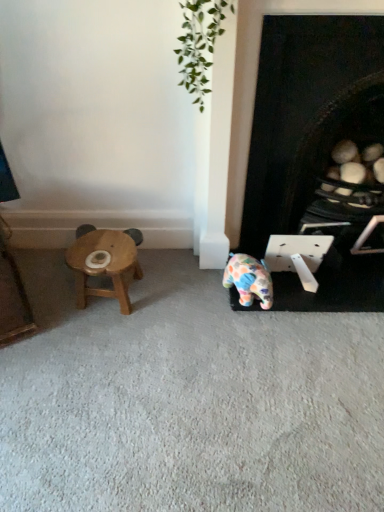
The width and height of the screenshot is (384, 512). What do you see at coordinates (307, 113) in the screenshot?
I see `black matte fireplace at lower right` at bounding box center [307, 113].

Describe the element at coordinates (249, 280) in the screenshot. I see `polka dot ceramic elephant at center` at that location.

This screenshot has width=384, height=512. Identify the location of wooden stool at left. (103, 264).

You are a GUI agent. You are given a task and a screenshot of the screen. Output one action in this format:
    pyautogui.click(x=<x>, y=<y>)
    Task: Click on the black matte fireplace at lower right
    The image size is (384, 512).
    Given the screenshot: What is the action you would take?
    pyautogui.click(x=307, y=113)

Considering the relative positions of wooden stool at left and polka dot ceramic elephant at center in the image provided, is wooden stool at left to the left of polka dot ceramic elephant at center from the viewer's perspective?

Indeed, wooden stool at left is positioned on the left side of polka dot ceramic elephant at center.

Looking at this image, from the image's perspective, would you say wooden stool at left is shown under polka dot ceramic elephant at center?

Incorrect, from the image's perspective, wooden stool at left is higher than polka dot ceramic elephant at center.

Measure the distance between wooden stool at left and polka dot ceramic elephant at center.

They are 19.07 inches apart.

Is wooden stool at left looking in the opposite direction of black matte fireplace at lower right?

wooden stool at left is not turned away from black matte fireplace at lower right.

Considering the sizes of wooden stool at left and black matte fireplace at lower right in the image, is wooden stool at left taller or shorter than black matte fireplace at lower right?

wooden stool at left is shorter than black matte fireplace at lower right.

Is point (79, 302) more distant than point (283, 286)?

No, it is in front of (283, 286).

Is wooden stool at left directly adjacent to black matte fireplace at lower right?

No, wooden stool at left is not making contact with black matte fireplace at lower right.

Is black matte fireplace at lower right completely or partially outside of polka dot ceramic elephant at center?

black matte fireplace at lower right is positioned outside polka dot ceramic elephant at center.

Is black matte fireplace at lower right in front of or behind polka dot ceramic elephant at center in the image?

In the image, black matte fireplace at lower right appears in front of polka dot ceramic elephant at center.

From a real-world perspective, does black matte fireplace at lower right stand above polka dot ceramic elephant at center?

Yes, from a real-world perspective, black matte fireplace at lower right is over polka dot ceramic elephant at center

How different are the orientations of black matte fireplace at lower right and polka dot ceramic elephant at center in degrees?

There is a 5.28-degree angle between the facing directions of black matte fireplace at lower right and polka dot ceramic elephant at center.

Measure the distance from polka dot ceramic elephant at center to wooden stool at left.

polka dot ceramic elephant at center is 19.07 inches from wooden stool at left.

Looking at this image, is polka dot ceramic elephant at center positioned far away from wooden stool at left?

They are positioned close to each other.

From the image's perspective, which object appears higher, polka dot ceramic elephant at center or wooden stool at left?

wooden stool at left.

Is polka dot ceramic elephant at center looking in the opposite direction of wooden stool at left?

No, polka dot ceramic elephant at center is not facing away from wooden stool at left.

Which is correct: black matte fireplace at lower right is inside wooden stool at left, or outside of it?

black matte fireplace at lower right lies outside wooden stool at left.

Between black matte fireplace at lower right and wooden stool at left, which one has smaller size?

wooden stool at left is smaller.

From the image's perspective, is black matte fireplace at lower right positioned above or below wooden stool at left?

Based on their image positions, black matte fireplace at lower right is located above wooden stool at left.

Consider the image. Which object is thinner, black matte fireplace at lower right or wooden stool at left?

wooden stool at left.

Can you tell me how much polka dot ceramic elephant at center and black matte fireplace at lower right differ in facing direction?

5.28 degrees.

Does polka dot ceramic elephant at center contain black matte fireplace at lower right?

No, polka dot ceramic elephant at center does not contain black matte fireplace at lower right.

From a real-world perspective, which object stands above the other?

black matte fireplace at lower right.

Does point (248, 287) appear closer or farther from the camera than point (291, 58)?

Point (248, 287) is positioned farther from the camera compared to point (291, 58).

The width and height of the screenshot is (384, 512). What are the coordinates of `stool on the left of polka dot ceramic elephant at center` in the screenshot? It's located at (103, 264).

This screenshot has width=384, height=512. In the image, there is a wooden stool at left. Find the location of `fireplace above it (from the image's perspective)`. fireplace above it (from the image's perspective) is located at coordinates (307, 113).

Looking at the image, which one is located closer to black matte fireplace at lower right, wooden stool at left or polka dot ceramic elephant at center?

polka dot ceramic elephant at center is closer to black matte fireplace at lower right.

From the image, which object appears to be farther from polka dot ceramic elephant at center, wooden stool at left or black matte fireplace at lower right?

wooden stool at left is further to polka dot ceramic elephant at center.

When comparing their distances from polka dot ceramic elephant at center, does black matte fireplace at lower right or wooden stool at left seem further?

wooden stool at left.

Estimate the real-world distances between objects in this image. Which object is further from black matte fireplace at lower right, polka dot ceramic elephant at center or wooden stool at left?

The object further to black matte fireplace at lower right is wooden stool at left.

Based on their spatial positions, is polka dot ceramic elephant at center or black matte fireplace at lower right further from wooden stool at left?

The object further to wooden stool at left is black matte fireplace at lower right.

Estimate the real-world distances between objects in this image. Which object is further from wooden stool at left, black matte fireplace at lower right or polka dot ceramic elephant at center?

black matte fireplace at lower right is positioned further to the anchor wooden stool at left.

Where is `toy between wooden stool at left and black matte fireplace at lower right in the horizontal direction`? The image size is (384, 512). toy between wooden stool at left and black matte fireplace at lower right in the horizontal direction is located at coordinates (249, 280).